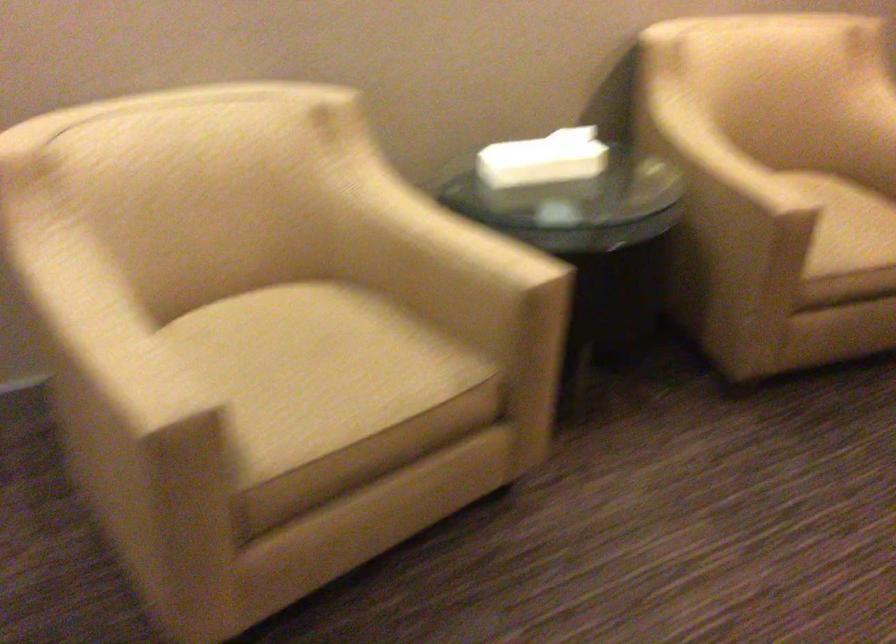
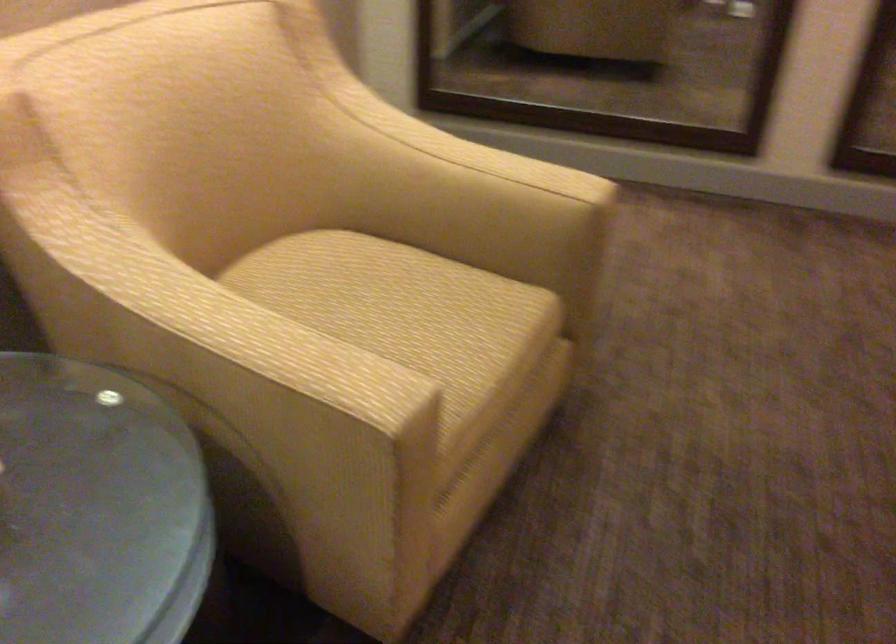
In the second image, find the point that corresponds to point (721, 149) in the first image.

(214, 313)